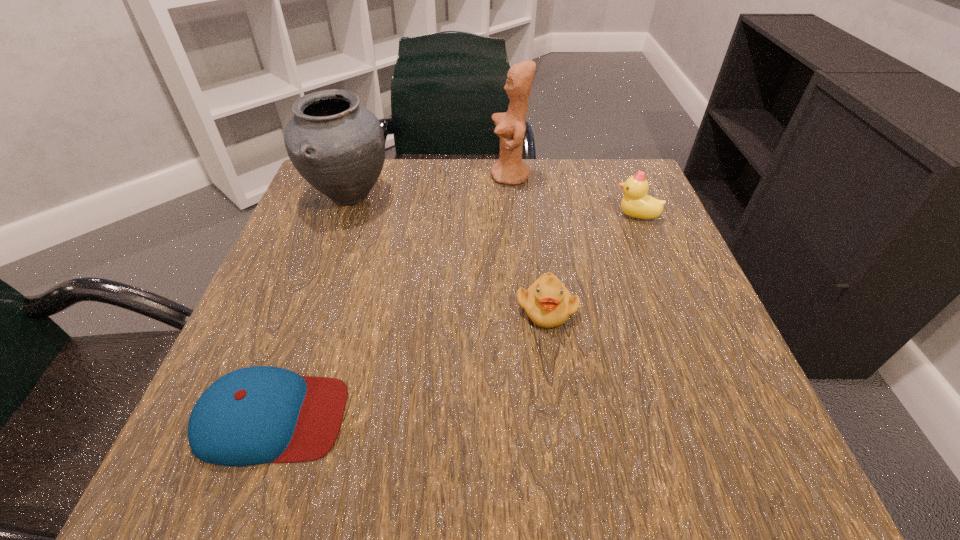
Identify the location of vacant region located 0.080m on the front-facing side of the figurine. (457, 176).

What are the coordinates of `blank space located 0.290m on the right of the second tallest object` in the screenshot? It's located at (523, 196).

Locate an element on the screen. vacant space located on the front-facing side of the farther duckling is located at coordinates point(510,215).

Where is `vacant space located on the front-facing side of the farther duckling`? The image size is (960, 540). vacant space located on the front-facing side of the farther duckling is located at coordinates (505, 215).

What are the coordinates of `vacant point located on the front-facing side of the farther duckling` in the screenshot? It's located at (491, 215).

This screenshot has height=540, width=960. I want to click on vacant area situated on the front-facing side of the fourth farthest object, so click(559, 399).

Where is `free region located 0.110m with the bill of the nearest object facing forward`? This screenshot has height=540, width=960. free region located 0.110m with the bill of the nearest object facing forward is located at coordinates (426, 417).

Image resolution: width=960 pixels, height=540 pixels. Identify the location of figurine present at the far edge. (510, 169).

This screenshot has height=540, width=960. What are the coordinates of `urn that is at the far edge` in the screenshot? It's located at (337, 145).

Locate an element on the screen. The image size is (960, 540). duckling that is positioned at the far edge is located at coordinates (636, 203).